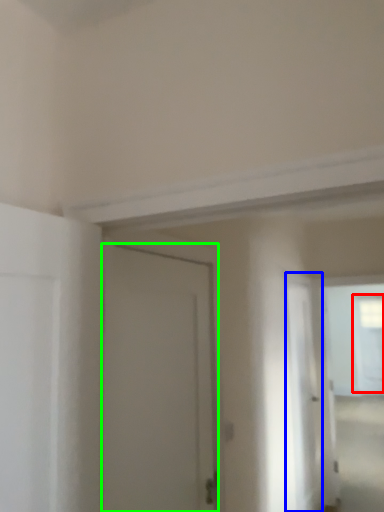
Question: Which object is the farthest from window (highlighted by a red box)? Choose among these: screen door (highlighted by a blue box) or door (highlighted by a green box).

Choices:
 (A) screen door
 (B) door

Answer: (B)